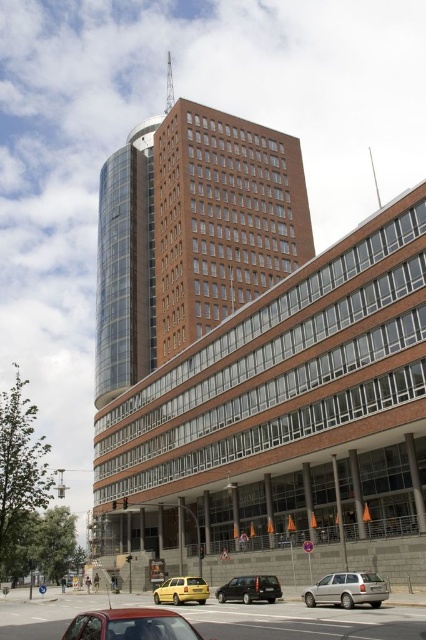
Question: Which point appears closest to the camera in this image?

Choices:
 (A) (147, 214)
 (B) (155, 602)
 (C) (158, 330)
 (D) (244, 577)

Answer: (D)

Question: Does transparent glass tower at upper left appear over silver metallic station wagon at lower right?

Choices:
 (A) no
 (B) yes

Answer: (B)

Question: Which point appears closest to the camera in this image?

Choices:
 (A) (175, 634)
 (B) (152, 298)
 (C) (226, 600)
 (D) (347, 602)

Answer: (A)

Question: Can you confirm if matte black van at center is positioned to the left of yellow matte taxi at lower center?

Choices:
 (A) yes
 (B) no

Answer: (B)

Question: Which object appears closest to the camera in this image?

Choices:
 (A) yellow matte taxi at lower center
 (B) transparent glass tower at upper left
 (C) matte red car at lower left
 (D) matte black van at center

Answer: (C)

Question: Can you confirm if transparent glass tower at upper left is positioned to the right of matte red car at lower left?

Choices:
 (A) yes
 (B) no

Answer: (B)